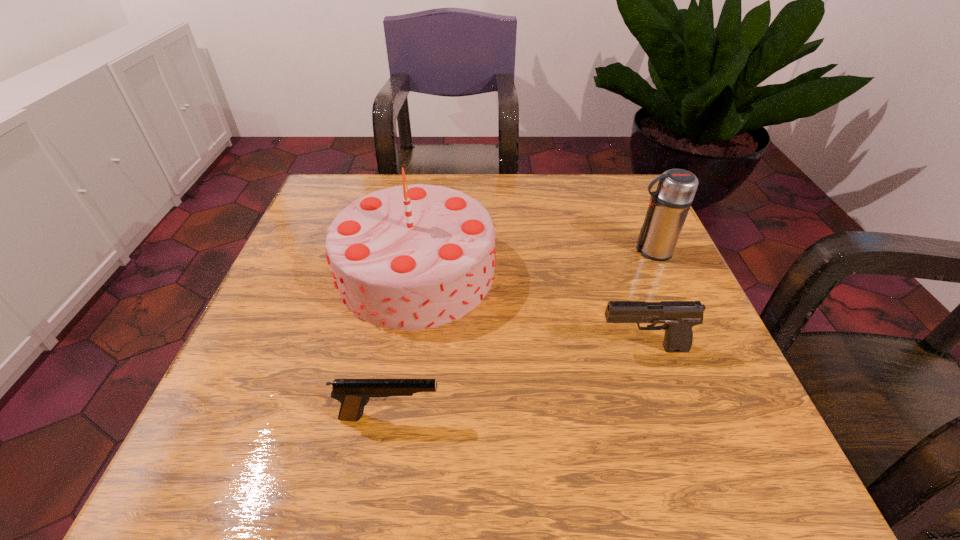
The image size is (960, 540). I want to click on vacant space that satisfies the following two spatial constraints: 1. with a handle on the side of the thermos bottle; 2. on the front side of the birthday cake, so click(660, 271).